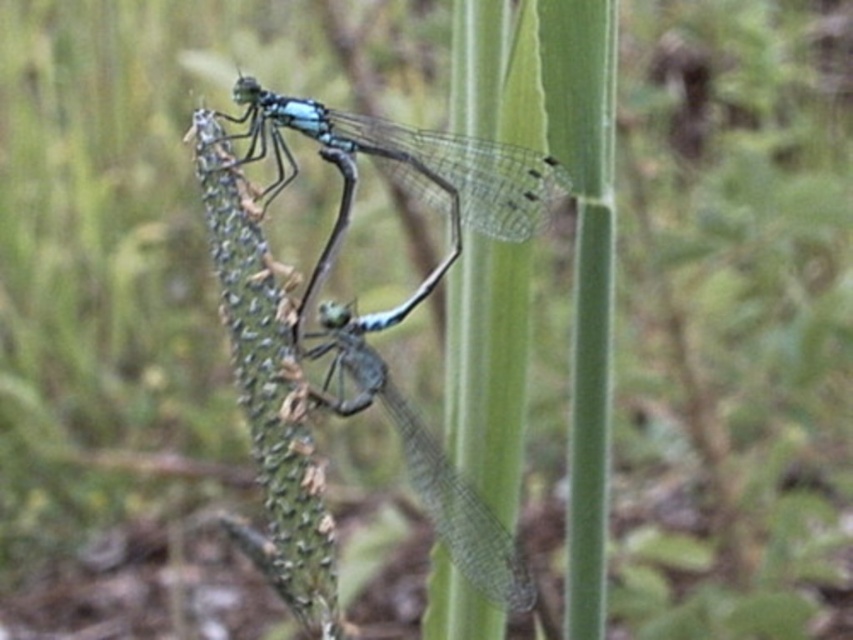
This screenshot has width=853, height=640. Describe the element at coordinates (412, 172) in the screenshot. I see `translucent blue dragonfly at center` at that location.

Find the location of a particular element. translucent blue dragonfly at center is located at coordinates (412, 172).

At what (x,y) coordinates should I click in order to perform the action: click on translucent blue dragonfly at center. Please return your answer as a coordinate pair (x, y). This screenshot has width=853, height=640. Looking at the image, I should click on (412, 172).